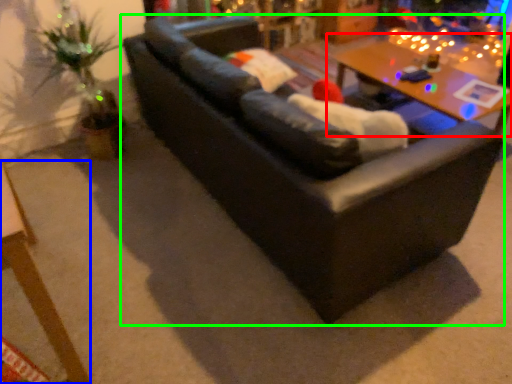
Question: Considering the real-world distances, which object is closest to table (highlighted by a red box)? table (highlighted by a blue box) or studio couch (highlighted by a green box).

Choices:
 (A) table
 (B) studio couch

Answer: (B)